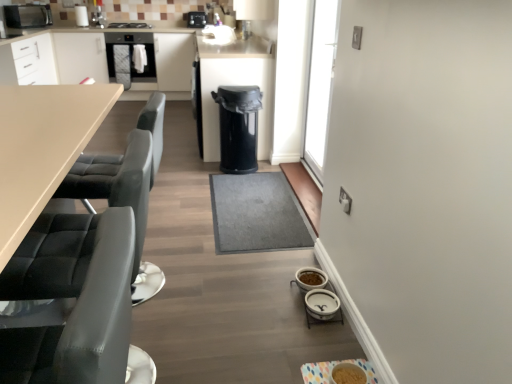
Question: Considering the positions of black matte stove at upper center and white ceramic bowls at lower center, which appears as the 3th appliance when viewed from the front, in the image, is black matte stove at upper center taller or shorter than white ceramic bowls at lower center, which appears as the 3th appliance when viewed from the front,?

Choices:
 (A) tall
 (B) short

Answer: (B)

Question: From a real-world perspective, relative to white ceramic bowls at lower center, which is counted as the 6th appliance, starting from the left, is black matte stove at upper center vertically above or below?

Choices:
 (A) above
 (B) below

Answer: (A)

Question: Which of these objects is positioned farthest from the black matte microwave at upper left, which ranks as the 7th appliance in right-to-left order?

Choices:
 (A) matte black oven at upper left
 (B) white ceramic bowls at lower right, marked as the fourth appliance in a left-to-right arrangement
 (C) matte plastic bowl at lower center, the 7th appliance when ordered from back to front
 (D) black leather swivel chair at left
 (E) black plastic camera at upper center, the first appliance when ordered from top to bottom

Answer: (C)

Question: Which is nearer to the gray carpet at center?

Choices:
 (A) black plastic camera at upper center, marked as the 2th appliance in a left-to-right arrangement
 (B) black matte stove at upper center
 (C) black matte microwave at upper left, which ranks as the 7th appliance in right-to-left order
 (D) black plastic trash can at center, the 5th appliance positioned from the right
 (E) matte plastic bowl at lower center, the seventh appliance positioned from the top

Answer: (D)